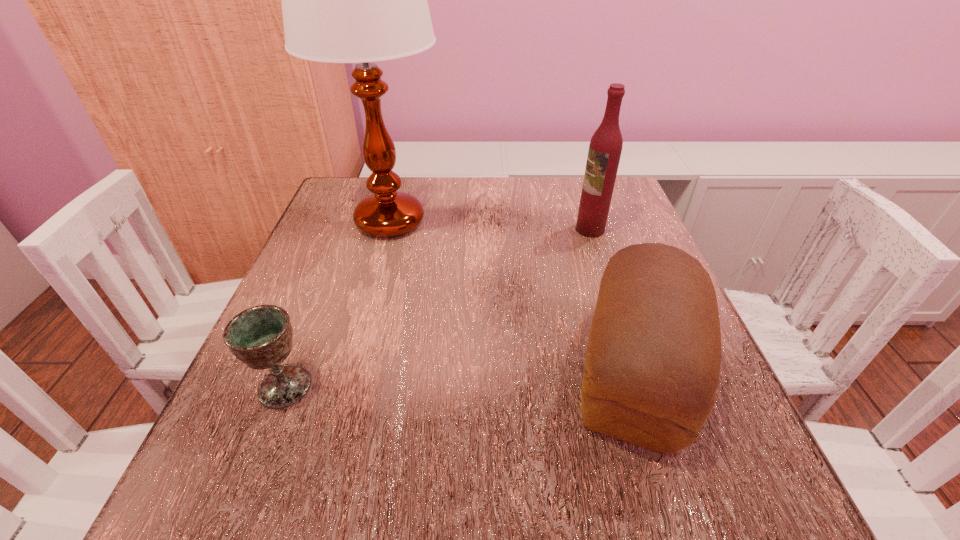
Identify the location of the tallest object. Image resolution: width=960 pixels, height=540 pixels. 360,0.

Locate an element on the screen. The height and width of the screenshot is (540, 960). the second tallest object is located at coordinates (605, 148).

Locate an element on the screen. The image size is (960, 540). bread is located at coordinates (653, 359).

Locate an element on the screen. chalice is located at coordinates (261, 337).

Where is `free space located on the right of the tallest object`? Image resolution: width=960 pixels, height=540 pixels. free space located on the right of the tallest object is located at coordinates (515, 221).

Where is `vacant space located on the label of the liquor`? The height and width of the screenshot is (540, 960). vacant space located on the label of the liquor is located at coordinates [x=466, y=230].

Identify the location of vacant region located 0.260m on the label of the liquor. (462, 230).

This screenshot has height=540, width=960. I want to click on vacant space positioned on the label of the liquor, so click(515, 230).

Locate an element on the screen. This screenshot has height=540, width=960. free space located on the left of the second shortest object is located at coordinates (500, 372).

Locate an element on the screen. This screenshot has width=960, height=540. vacant area situated 0.310m on the right of the shortest object is located at coordinates (513, 387).